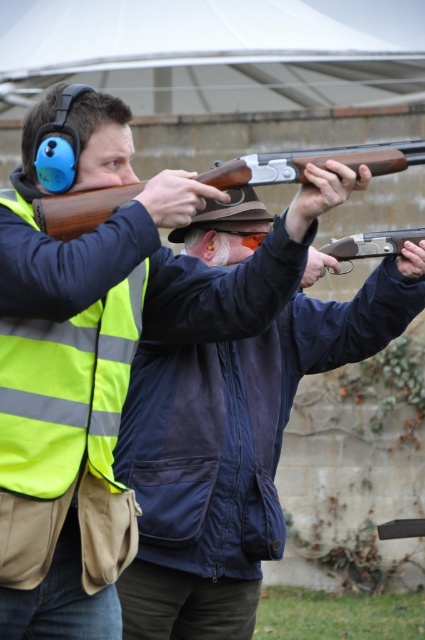
From the picture: Is matte brown shotgun at center behind matte brown shotgun at upper center?

That is False.

Is matte brown shotgun at center shorter than matte brown shotgun at upper center?

Incorrect, matte brown shotgun at center's height does not fall short of matte brown shotgun at upper center's.

Find the location of a particular element. The height and width of the screenshot is (640, 425). matte brown shotgun at center is located at coordinates (229, 454).

Who is more distant from viewer, (x=198, y=545) or (x=374, y=161)?

The point (x=198, y=545) is behind.

Between matte brown shotgun at center and wooden shotgun at center, which one is positioned lower?

matte brown shotgun at center

Between point (121, 444) and point (212, 172), which one is positioned behind?

The point (121, 444) is more distant.

Identify the location of matte brown shotgun at center. (x=229, y=454).

Can you confirm if wooden shotgun at center is smaller than matte brown shotgun at upper center?

Indeed, wooden shotgun at center has a smaller size compared to matte brown shotgun at upper center.

Is wooden shotgun at center to the left of matte brown shotgun at upper center from the viewer's perspective?

Correct, you'll find wooden shotgun at center to the left of matte brown shotgun at upper center.

I want to click on wooden shotgun at center, so click(312, 163).

The image size is (425, 640). I want to click on wooden shotgun at center, so click(312, 163).